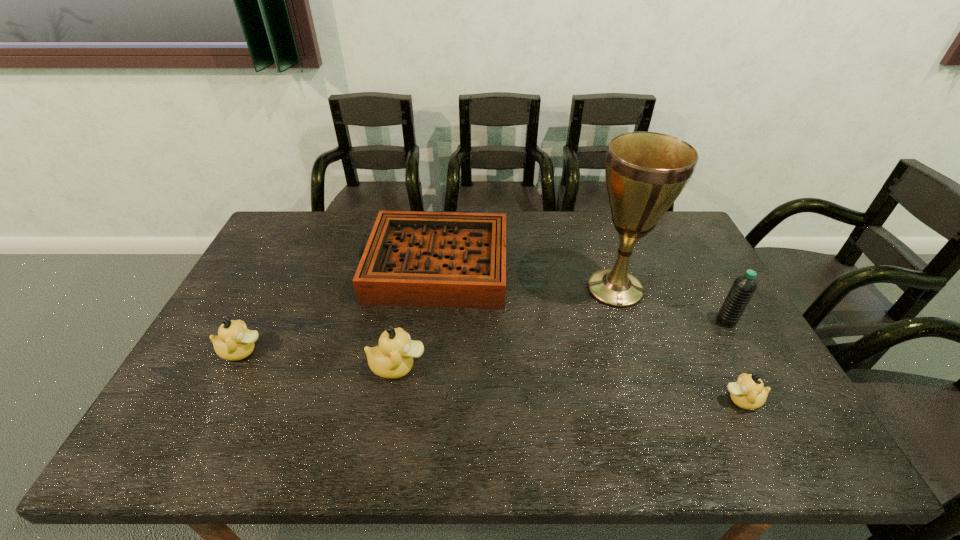
Identify the location of vacant space at the near left corner. The width and height of the screenshot is (960, 540). (232, 397).

This screenshot has width=960, height=540. I want to click on vacant space at the far right corner of the desktop, so click(x=681, y=228).

At what (x,y) coordinates should I click in order to perform the action: click on vacant space that is in between the water bottle and the shortest duckling. Please return your answer as a coordinate pair (x, y). Looking at the image, I should click on (733, 361).

Find the location of a particular element. Image resolution: width=960 pixels, height=540 pixels. unoccupied position between the water bottle and the nearest object is located at coordinates [733, 361].

Where is `blank region between the shortest duckling and the fourth nearest object`? blank region between the shortest duckling and the fourth nearest object is located at coordinates (733, 361).

Locate an element on the screen. vacant space that's between the tallest object and the fifth shortest object is located at coordinates (670, 305).

I want to click on free space that is in between the tallest duckling and the gameboard, so click(417, 316).

Locate an element on the screen. vacant point located between the trophy cup and the water bottle is located at coordinates (670, 305).

Locate an element on the screen. The image size is (960, 540). vacant area that lies between the second tallest duckling and the third tallest object is located at coordinates (320, 359).

The width and height of the screenshot is (960, 540). Identify the location of blank region between the water bottle and the trophy cup. (670, 305).